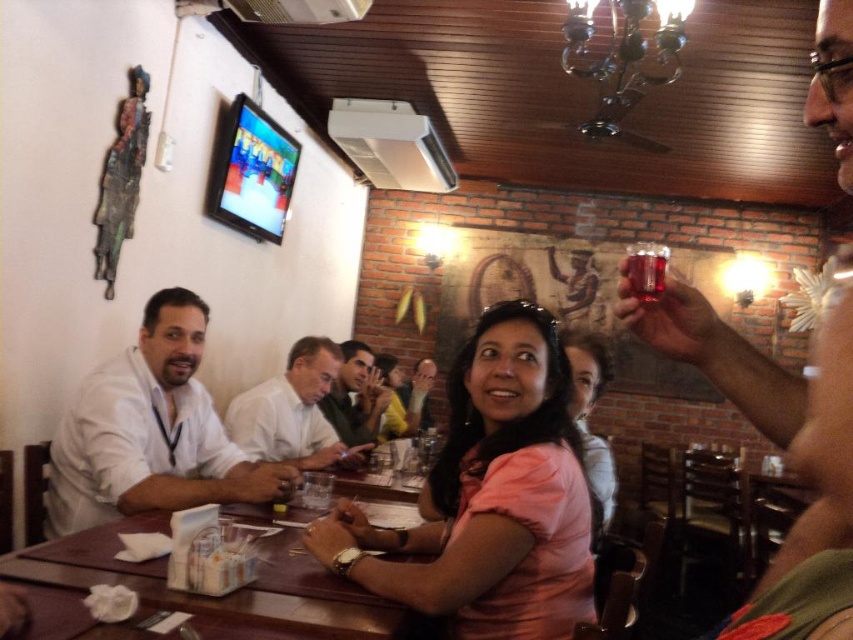
Based on the photo, is shiny metallic cup at upper right closer to camera compared to brown wooden table at center?

Yes, it is.

Which is above, shiny metallic cup at upper right or brown wooden table at center?

shiny metallic cup at upper right is higher up.

What do you see at coordinates (718, 356) in the screenshot?
I see `shiny metallic cup at upper right` at bounding box center [718, 356].

This screenshot has width=853, height=640. What are the coordinates of `shiny metallic cup at upper right` in the screenshot? It's located at (718, 356).

Looking at this image, is white shirt at center to the left of light brown leather shirt at center from the viewer's perspective?

Indeed, white shirt at center is positioned on the left side of light brown leather shirt at center.

Which is behind, point (236, 416) or point (325, 403)?

The point (325, 403) is more distant.

Identify the location of white shirt at center. (292, 412).

Can you confirm if brown wooden table at center is taller than smooth white shirt at center?

In fact, brown wooden table at center may be shorter than smooth white shirt at center.

Who is lower down, brown wooden table at center or smooth white shirt at center?

smooth white shirt at center is lower down.

Identify the location of brown wooden table at center. The image size is (853, 640). (213, 596).